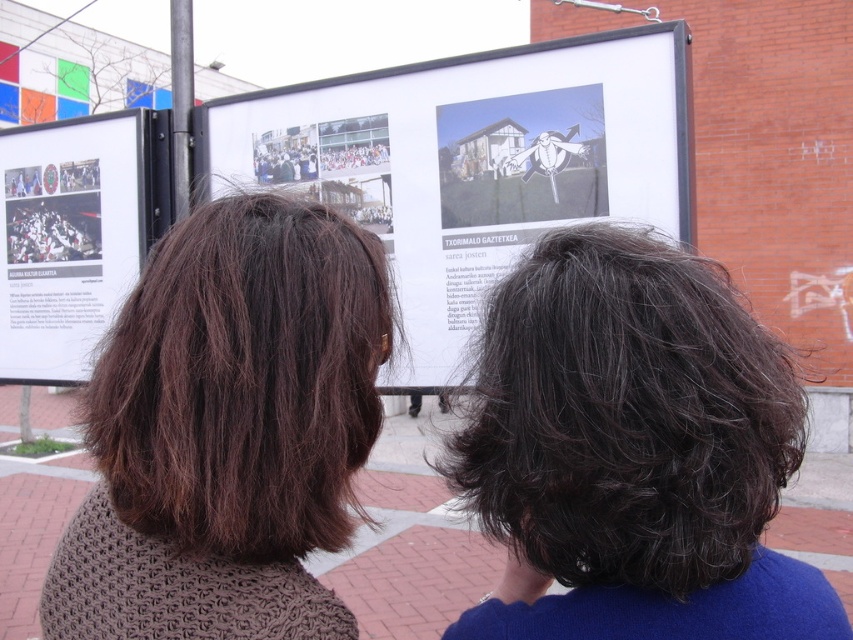
Can you confirm if dark brown curly hair at center is bigger than brown wavy hair at center?

Yes, dark brown curly hair at center is bigger than brown wavy hair at center.

Which is more to the right, dark brown curly hair at center or brown wavy hair at center?

dark brown curly hair at center is more to the right.

Who is more forward, (529, 429) or (323, 458)?

Positioned in front is point (529, 429).

The height and width of the screenshot is (640, 853). What are the coordinates of `dark brown curly hair at center` in the screenshot? It's located at (625, 417).

Which is below, brown wavy hair at center or matte paper poster at left?

brown wavy hair at center is below.

Is brown wavy hair at center below matte paper poster at left?

Indeed, brown wavy hair at center is positioned under matte paper poster at left.

Does point (306, 328) come in front of point (109, 132)?

That is True.

You are a GUI agent. You are given a task and a screenshot of the screen. Output one action in this format:
    pyautogui.click(x=<x>, y=<y>)
    Task: Click on the brown wavy hair at center
    The width and height of the screenshot is (853, 640).
    Given the screenshot: What is the action you would take?
    pyautogui.click(x=244, y=380)

Does dark brown curly hair at center have a larger size compared to matte paper poster at left?

Incorrect, dark brown curly hair at center is not larger than matte paper poster at left.

Who is more distant from viewer, (747, 513) or (135, 234)?

Positioned behind is point (135, 234).

Which is in front, point (511, 435) or point (22, 234)?

Point (511, 435) is more forward.

Where is `dark brown curly hair at center`? Image resolution: width=853 pixels, height=640 pixels. dark brown curly hair at center is located at coordinates 625,417.